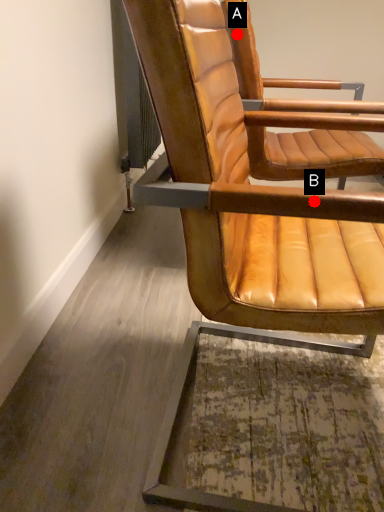
Question: Two points are circled on the image, labeled by A and B beside each circle. Among these points, which one is nearest to the camera?

Choices:
 (A) A is closer
 (B) B is closer

Answer: (B)